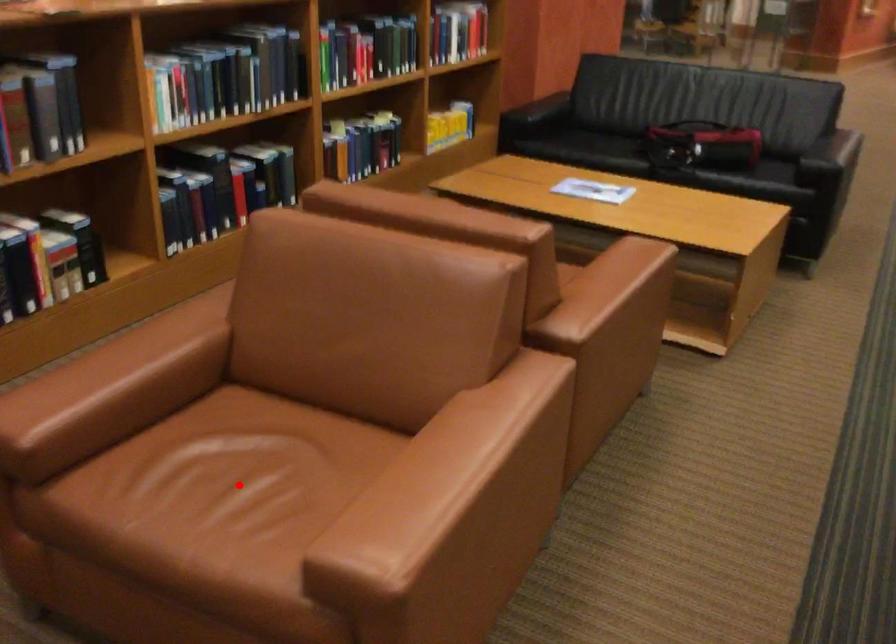
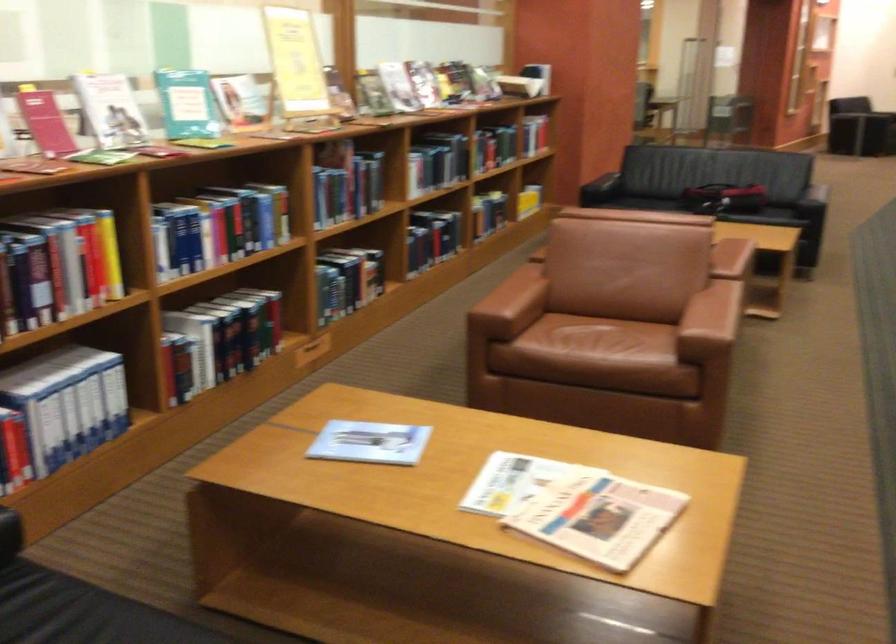
Find the pixel in the second image that matches the highlighted location in the first image.

(599, 342)